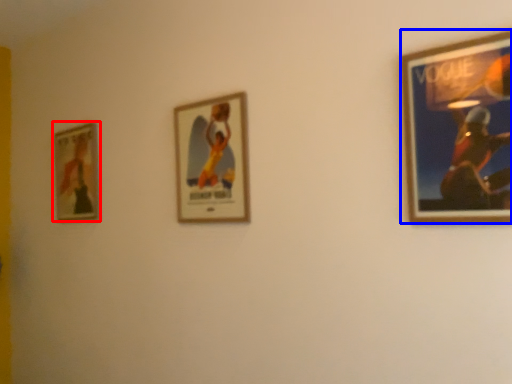
Question: Which of the following is the closest to the observer, picture frame (highlighted by a red box) or picture frame (highlighted by a blue box)?

Choices:
 (A) picture frame
 (B) picture frame

Answer: (B)